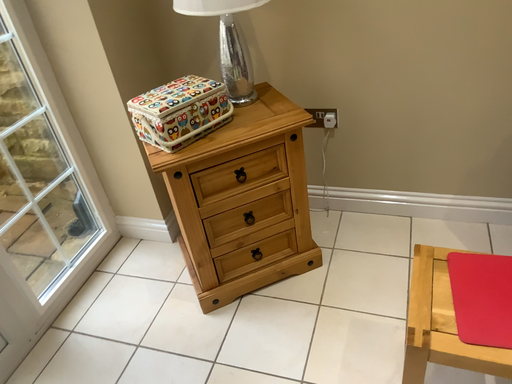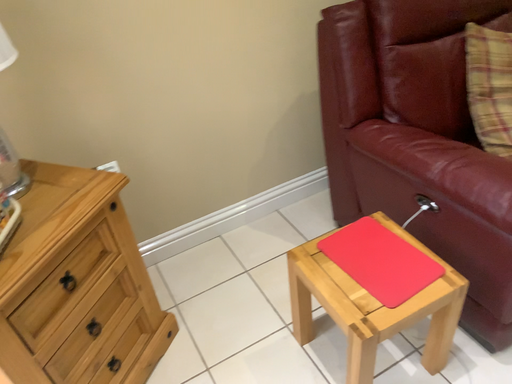
Question: How did the camera likely rotate when shooting the video?

Choices:
 (A) rotated upward
 (B) rotated downward

Answer: (A)